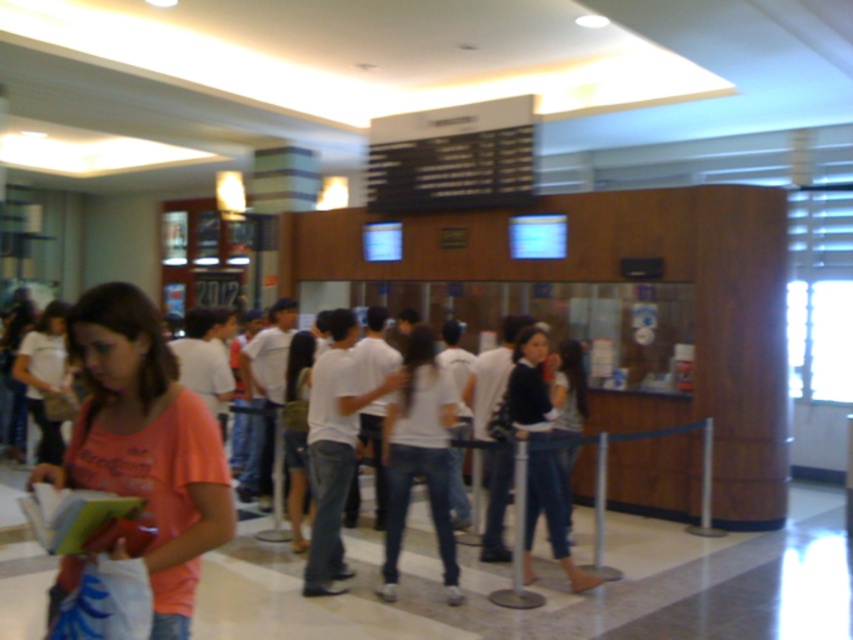
Question: Is matte pink t-shirt at center above denim jeans at center?

Choices:
 (A) no
 (B) yes

Answer: (B)

Question: Among these objects, which one is nearest to the camera?

Choices:
 (A) matte pink t-shirt at center
 (B) denim jeans at center

Answer: (A)

Question: Is matte pink t-shirt at center above denim jeans at center?

Choices:
 (A) no
 (B) yes

Answer: (B)

Question: Does matte pink t-shirt at center have a lesser width compared to denim jeans at center?

Choices:
 (A) yes
 (B) no

Answer: (B)

Question: Which object is closer to the camera taking this photo?

Choices:
 (A) denim jeans at center
 (B) matte pink t-shirt at center

Answer: (B)